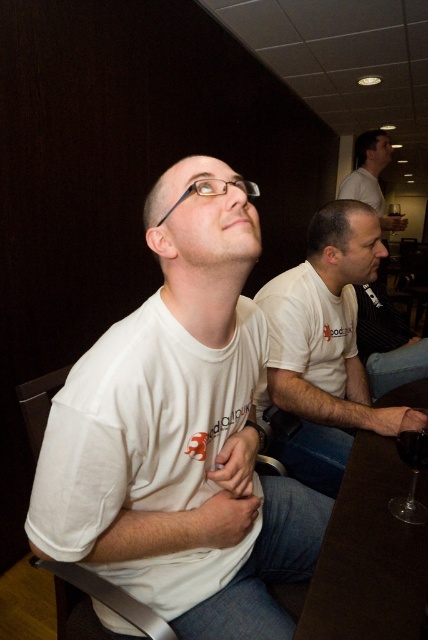
Question: Which of the following is the farthest from the observer?

Choices:
 (A) (424, 460)
 (B) (368, 189)
 (C) (389, 209)
 (D) (363, 602)

Answer: (C)

Question: Can you confirm if white t-shirt at center is positioned to the right of transparent glass wine at table right?

Choices:
 (A) no
 (B) yes

Answer: (A)

Question: Which point is farther from the camera taking this photo?

Choices:
 (A) (376, 148)
 (B) (395, 205)

Answer: (B)

Question: Estimate the real-world distances between objects in this image. Which object is farther from the white matte t-shirt at center?

Choices:
 (A) transparent glass wine at table right
 (B) brown wooden table at lower right
 (C) white t-shirt at center

Answer: (C)

Question: Can you confirm if white t-shirt at center is positioned below white t-shirt at upper center?

Choices:
 (A) no
 (B) yes

Answer: (B)

Question: Considering the relative positions of white matte t-shirt at center and white t-shirt at center in the image provided, where is white matte t-shirt at center located with respect to white t-shirt at center?

Choices:
 (A) above
 (B) below

Answer: (B)